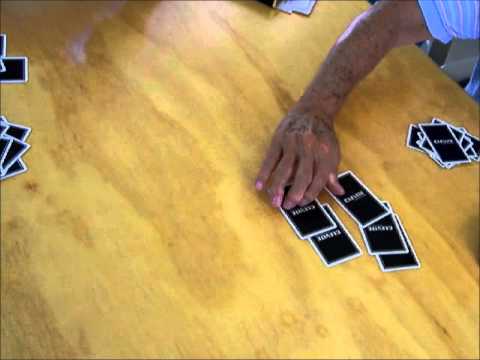
Identify the location of wood table. This screenshot has width=480, height=360. (179, 148).